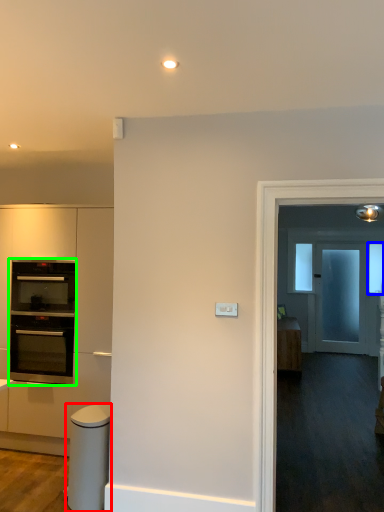
Question: Based on their relative distances, which object is nearer to appliance (highlighted by a red box)? Choose from window (highlighted by a blue box) and oven (highlighted by a green box).

Choices:
 (A) window
 (B) oven

Answer: (B)